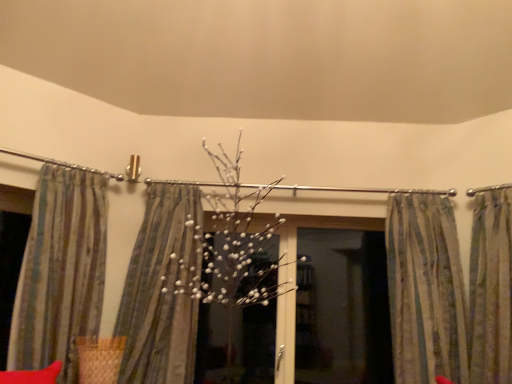
Question: Is metallic silver clothesline at upper left at the right side of striped fabric at center, the second curtain from the left?

Choices:
 (A) no
 (B) yes

Answer: (A)

Question: Is metallic silver clothesline at upper left outside of striped fabric at center, the third curtain positioned from the right?

Choices:
 (A) yes
 (B) no

Answer: (A)

Question: From the image's perspective, is metallic silver clothesline at upper left located above striped fabric at center, the third curtain positioned from the right?

Choices:
 (A) yes
 (B) no

Answer: (A)

Question: Is metallic silver clothesline at upper left oriented towards striped fabric at center, the third curtain positioned from the right?

Choices:
 (A) yes
 (B) no

Answer: (B)

Question: Is metallic silver clothesline at upper left bigger than striped fabric at center, the third curtain positioned from the right?

Choices:
 (A) no
 (B) yes

Answer: (A)

Question: From a real-world perspective, is metallic silver clothesline at upper left positioned over striped fabric at center, the second curtain from the left, based on gravity?

Choices:
 (A) no
 (B) yes

Answer: (B)

Question: Does transparent glass screen door at center lie in front of metallic silver clothesline at upper left?

Choices:
 (A) yes
 (B) no

Answer: (B)

Question: From a real-world perspective, is transparent glass screen door at center located higher than metallic silver clothesline at upper left?

Choices:
 (A) no
 (B) yes

Answer: (A)

Question: Is metallic silver clothesline at upper left at the back of transparent glass screen door at center?

Choices:
 (A) no
 (B) yes

Answer: (A)

Question: Can you confirm if transparent glass screen door at center is wider than metallic silver clothesline at upper left?

Choices:
 (A) yes
 (B) no

Answer: (A)

Question: Is transparent glass screen door at center taller than metallic silver clothesline at upper left?

Choices:
 (A) yes
 (B) no

Answer: (A)

Question: From the image's perspective, is transparent glass screen door at center above metallic silver clothesline at upper left?

Choices:
 (A) yes
 (B) no

Answer: (B)

Question: Can you confirm if striped fabric curtain at left, acting as the 1th curtain starting from the left, is bigger than metallic silver clothesline at upper left?

Choices:
 (A) yes
 (B) no

Answer: (A)